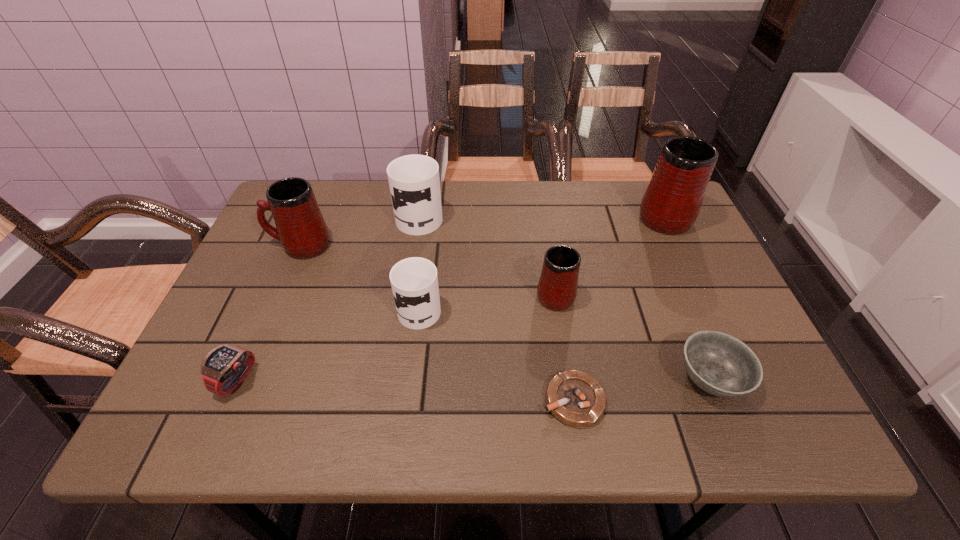
This screenshot has width=960, height=540. In order to click on bowl in this screenshot , I will do `click(720, 364)`.

Identify the location of the shortest object. click(x=577, y=399).

At what (x,y) coordinates should I click in order to perform the action: click on free space located 0.070m on the handle side of the bigger white mug. Please return your answer as a coordinate pair (x, y). This screenshot has height=540, width=960. Looking at the image, I should click on (424, 183).

The image size is (960, 540). Identify the location of free space located on the handle side of the bigger white mug. (424, 185).

The height and width of the screenshot is (540, 960). Identify the location of vacant space positioned 0.130m on the side of the second red mug from right to left with the handle. (546, 240).

Locate an element on the screen. free spot located on the side of the second red mug from right to left with the handle is located at coordinates (546, 240).

Where is `free region located 0.400m on the side of the second red mug from right to left with the handle`? This screenshot has height=540, width=960. free region located 0.400m on the side of the second red mug from right to left with the handle is located at coordinates (538, 183).

The image size is (960, 540). I want to click on free location located 0.260m on the handle side of the smaller white mug, so click(x=431, y=219).

The width and height of the screenshot is (960, 540). What are the coordinates of `vacant position located on the handle side of the smaller white mug` in the screenshot? It's located at (432, 212).

What are the coordinates of `vacant space located 0.140m on the handle side of the smaller white mug` in the screenshot? It's located at (427, 247).